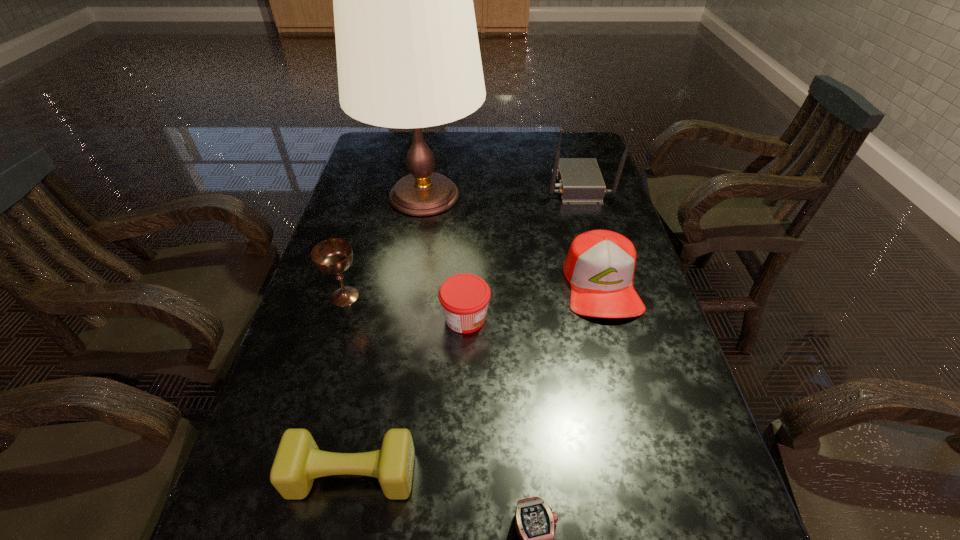
Identify the location of object that is at the far left corner. The height and width of the screenshot is (540, 960). (408, 56).

Find the location of a particular element. The image size is (960, 540). vacant region at the far edge is located at coordinates (451, 158).

This screenshot has height=540, width=960. In the image, there is a desktop. Identify the location of free region at the left edge. (377, 223).

Locate an element on the screen. The height and width of the screenshot is (540, 960). vacant area at the right edge is located at coordinates (672, 464).

At what (x,y) coordinates should I click in order to perform the action: click on free space at the far left corner of the desktop. Please return your answer as a coordinate pair (x, y). Looking at the image, I should click on (393, 140).

This screenshot has width=960, height=540. In order to click on vacant space at the far right corner of the desktop in this screenshot , I will do `click(554, 153)`.

Image resolution: width=960 pixels, height=540 pixels. What are the coordinates of `empty location between the chalice and the second tallest object` in the screenshot? It's located at (462, 241).

Identify the location of vacant region between the second nearest object and the fourth shortest object. pos(477,379).

Image resolution: width=960 pixels, height=540 pixels. What are the coordinates of `free point between the sixth shortest object and the third tallest object` in the screenshot? It's located at (462, 241).

The image size is (960, 540). I want to click on free area in between the sixth shortest object and the third tallest object, so click(x=462, y=241).